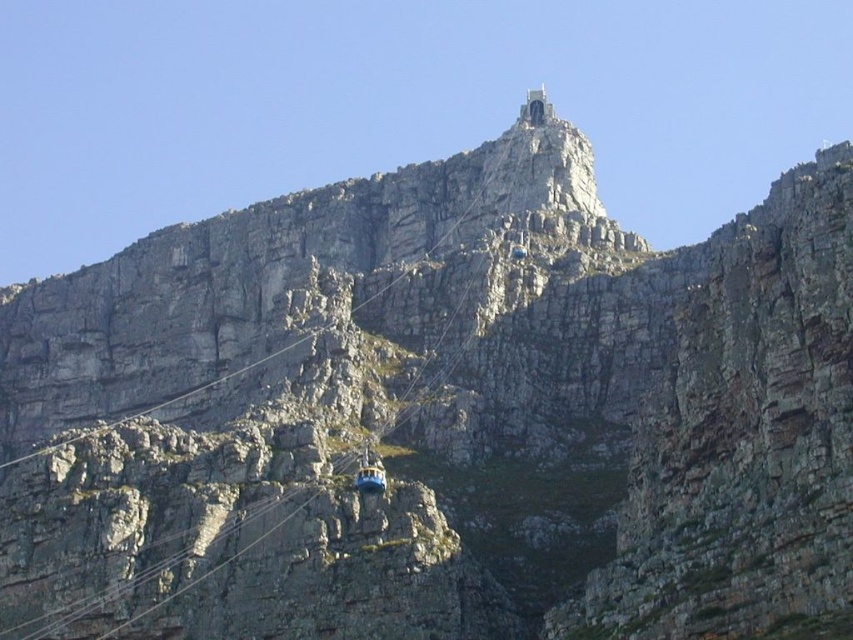
Question: Which point appears farthest from the camera in this image?

Choices:
 (A) (524, 253)
 (B) (386, 481)
 (C) (546, 106)

Answer: (C)

Question: Does smooth stone peak at upper center have a smaller size compared to blue metallic cable car at upper center?

Choices:
 (A) yes
 (B) no

Answer: (B)

Question: Which point is farther from the camera taking this photo?

Choices:
 (A) (367, 483)
 (B) (521, 250)
 (C) (521, 120)

Answer: (C)

Question: In this image, where is metallic yellow cable car at center located relative to blue metallic cable car at upper center?

Choices:
 (A) below
 (B) above

Answer: (A)

Question: Does metallic yellow cable car at center appear over blue metallic cable car at upper center?

Choices:
 (A) no
 (B) yes

Answer: (A)

Question: Which point is farther to the camera?

Choices:
 (A) blue metallic cable car at upper center
 (B) metallic yellow cable car at center
 (C) smooth stone peak at upper center

Answer: (C)